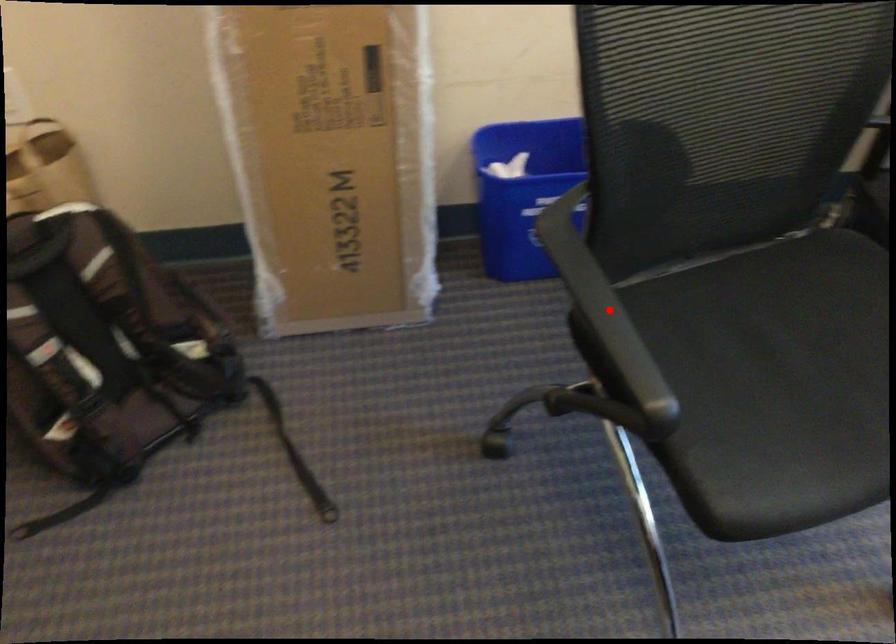
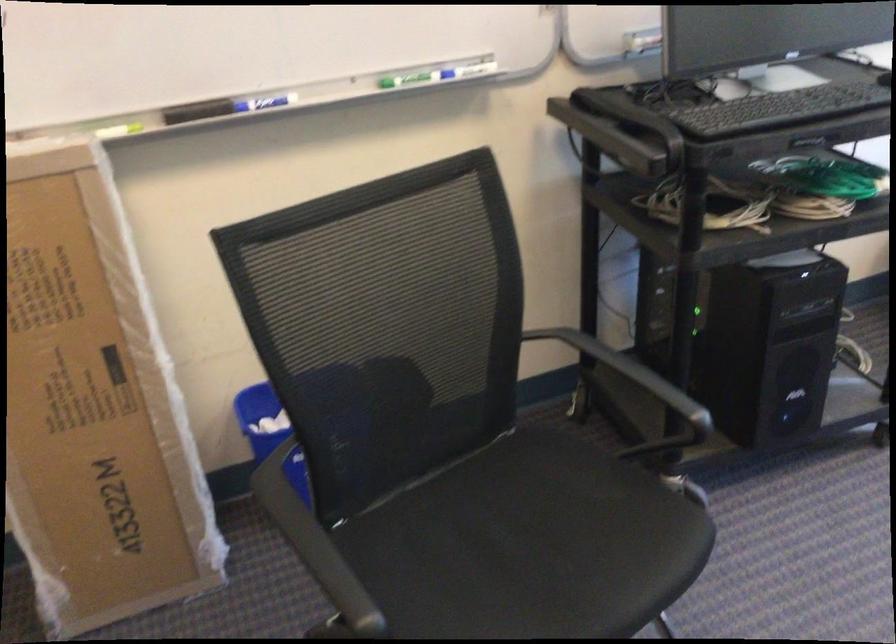
In the second image, find the point that corresponds to the highlighted location in the first image.

(314, 545)